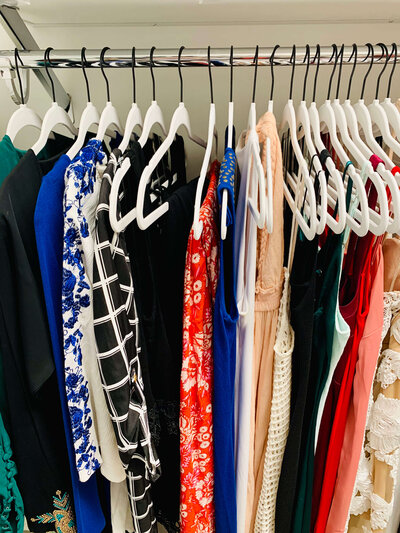
Image resolution: width=400 pixels, height=533 pixels. I want to click on wall, so click(190, 87).